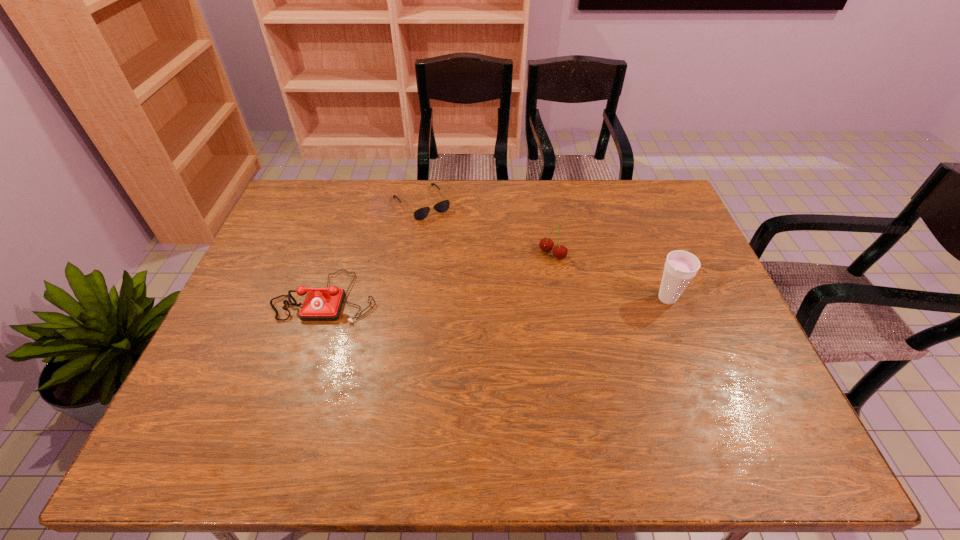
Identify the location of vacant area that lies between the telephone and the shortest object. (374, 250).

You are a GUI agent. You are given a task and a screenshot of the screen. Output one action in this format:
    pyautogui.click(x=<x>, y=<y>)
    Task: Click on the vacant area between the farthest object and the third object from left to right
    
    Given the screenshot: What is the action you would take?
    pyautogui.click(x=488, y=228)

The height and width of the screenshot is (540, 960). I want to click on blank region between the second shortest object and the cherry, so click(x=440, y=275).

Identify the location of unoccupied area between the third shortest object and the sunglasses. The image size is (960, 540). (488, 228).

Where is `empty location between the third nearest object and the third tallest object`? This screenshot has width=960, height=540. empty location between the third nearest object and the third tallest object is located at coordinates (440, 275).

Identify the location of object that can be found as the second closest to the third object from left to right. (420, 214).

Locate which object is the closest to the farthest object. Please provide its 2D coordinates. Your answer should be formatted as a tuple, i.e. [(x, y)], where the tuple contains the x and y coordinates of a point satisfying the conditions above.

[(321, 304)]

Identify the location of free space that satisfies the following two spatial constraints: 1. on the front side of the farthest object; 2. on the left side of the second object from right to left. (415, 254).

At what (x,y) coordinates should I click in order to perform the action: click on vacant space that satisfies the following two spatial constraints: 1. on the dial of the telephone; 2. on the right side of the cup. Please return your answer as a coordinate pair (x, y). This screenshot has width=960, height=540. Looking at the image, I should click on (325, 299).